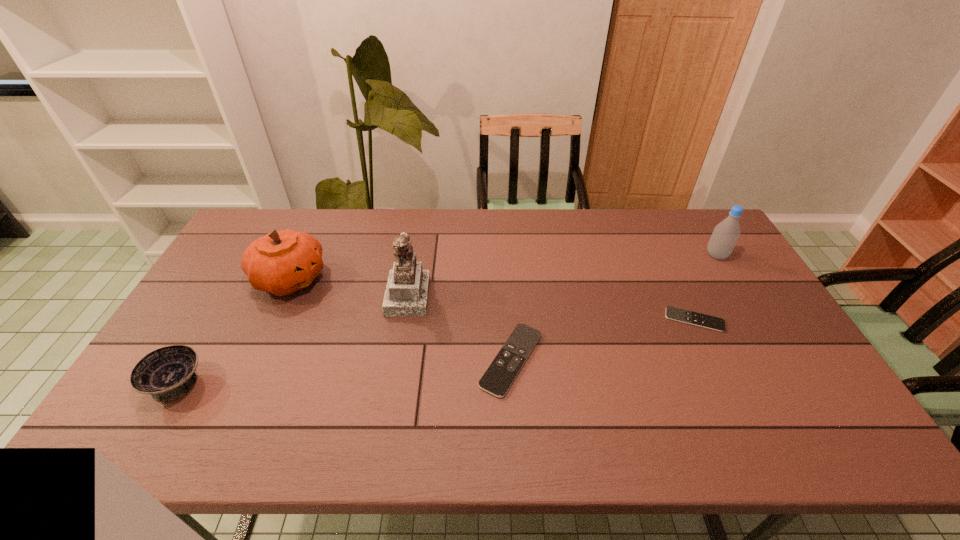
Where is `vacant area that lies between the bottle and the bowl`? This screenshot has height=540, width=960. vacant area that lies between the bottle and the bowl is located at coordinates (446, 319).

The image size is (960, 540). Identify the location of vacant area that lies between the shortest object and the third shortest object. (436, 352).

At what (x,y) coordinates should I click in order to perform the action: click on free space that is in between the left remote control and the bowl. Please return your answer as a coordinate pair (x, y). Image resolution: width=960 pixels, height=540 pixels. Looking at the image, I should click on (344, 372).

Find the location of a particular element. This screenshot has height=540, width=960. free spot between the third shortest object and the pumpkin is located at coordinates (233, 331).

Where is `free space between the third shortest object and the figurine`? This screenshot has width=960, height=540. free space between the third shortest object and the figurine is located at coordinates (292, 339).

Find the location of `free space that is in between the fourth tallest object and the right remote control`. free space that is in between the fourth tallest object and the right remote control is located at coordinates (436, 352).

The height and width of the screenshot is (540, 960). What are the coordinates of `free space between the pumpkin and the fifth tallest object` in the screenshot? It's located at (400, 319).

Image resolution: width=960 pixels, height=540 pixels. What are the coordinates of `vacant area between the fifth object from left to right and the left remote control` in the screenshot? It's located at (603, 340).

This screenshot has height=540, width=960. What are the coordinates of `vacant space in between the bottle and the tallest object` in the screenshot? It's located at (562, 275).

Identify which object is located as the third nearest to the bottle. Please provide its 2D coordinates. Your answer should be formatted as a tuple, i.e. [(x, y)], where the tuple contains the x and y coordinates of a point satisfying the conditions above.

[(407, 289)]